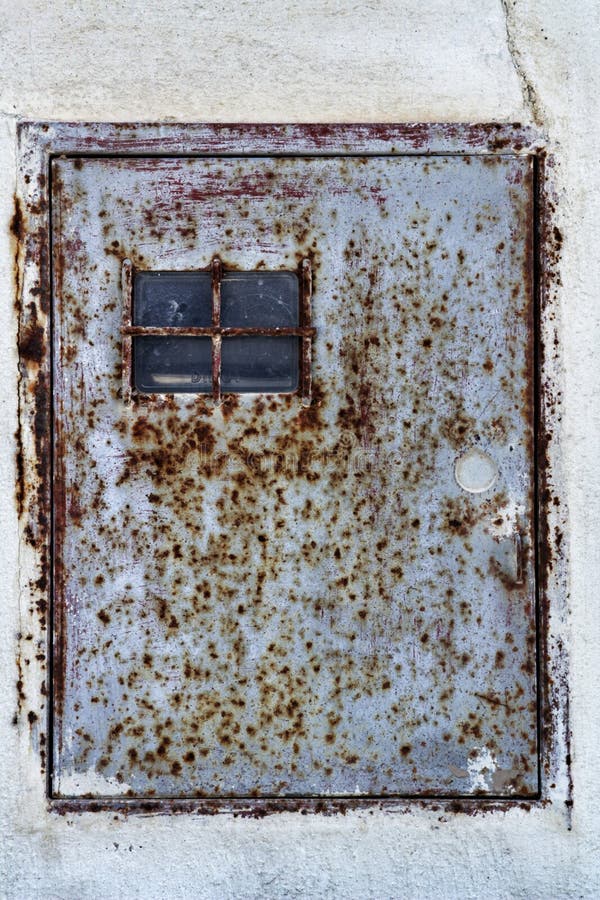
Where is `bottom door edge`? This screenshot has width=600, height=900. bottom door edge is located at coordinates (353, 795).